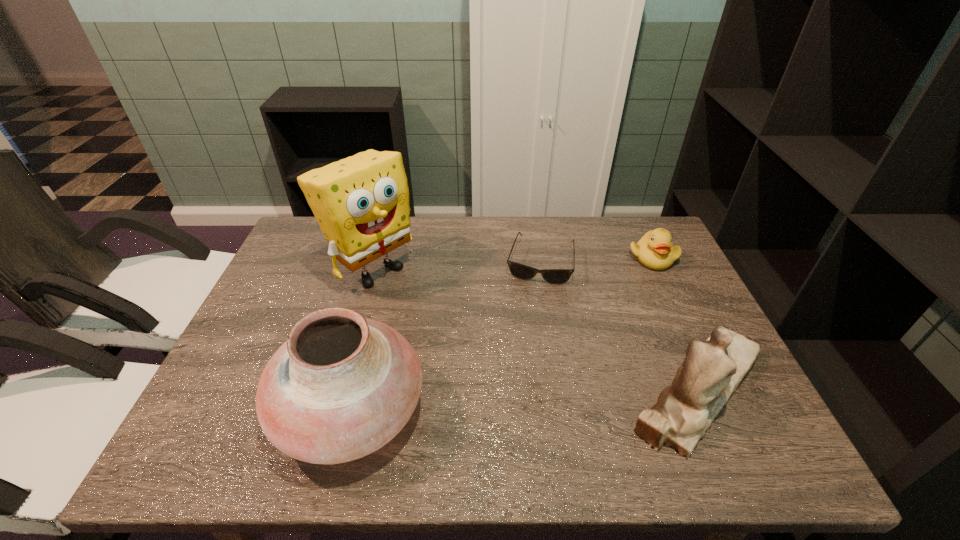
What are the coordinates of `vacant space on the desktop that is between the fourth shortest object and the third tallest object and is positioned on the face of the sponge` in the screenshot? It's located at (546, 399).

Locate an element on the screen. The image size is (960, 540). free space on the desktop that is between the pottery and the third tallest object and is positioned on the lenses of the sunglasses is located at coordinates (513, 401).

Locate an element on the screen. free space on the desktop that is between the second tallest object and the third tallest object and is positioned on the front-facing side of the fourth tallest object is located at coordinates (537, 400).